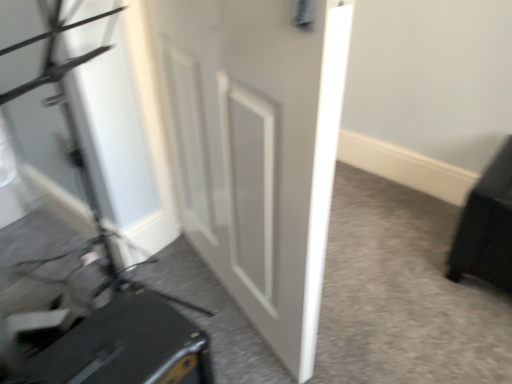
This screenshot has width=512, height=384. What do you see at coordinates (111, 269) in the screenshot?
I see `black matte suitcase at lower left` at bounding box center [111, 269].

At what (x,y) coordinates should I click in order to perform the action: click on matte black suitcase at lower left. Please return your answer as a coordinate pair (x, y). Looking at the image, I should click on (127, 347).

Is matte black suitcase at lower left placed right next to black matte suitcase at lower left?

matte black suitcase at lower left is not next to black matte suitcase at lower left, and they're not touching.

Where is `luggage that is behind the black matte suitcase at lower left`? This screenshot has height=384, width=512. luggage that is behind the black matte suitcase at lower left is located at coordinates (127, 347).

Is matte black suitcase at lower left inside or outside of black matte suitcase at lower left?

The correct answer is: outside.

Is matte black suitcase at lower left to the right of black matte suitcase at lower left from the viewer's perspective?

Correct, you'll find matte black suitcase at lower left to the right of black matte suitcase at lower left.

This screenshot has height=384, width=512. Find the location of `videotape positioned vertically above the white matte door at center (from a real-world perspective)`. videotape positioned vertically above the white matte door at center (from a real-world perspective) is located at coordinates (111, 269).

Measure the distance from white matte door at center to black matte suitcase at lower left.

A distance of 11.87 inches exists between white matte door at center and black matte suitcase at lower left.

Is white matte door at center positioned with its back to black matte suitcase at lower left?

Yes, black matte suitcase at lower left is at the back of white matte door at center.

In order to click on door located in front of the matte black suitcase at lower left in this screenshot , I will do `click(256, 149)`.

How different are the orientations of white matte door at center and matte black suitcase at lower left in degrees?

The facing directions of white matte door at center and matte black suitcase at lower left are 107 degrees apart.

Consider the image. From the image's perspective, would you say white matte door at center is positioned over matte black suitcase at lower left?

Yes.

How distant is white matte door at center from matte black suitcase at lower left?

white matte door at center is 15.51 inches away from matte black suitcase at lower left.

Does black matte suitcase at lower left come in front of white matte door at center?

Yes, black matte suitcase at lower left is in front of white matte door at center.

Can you confirm if black matte suitcase at lower left is bigger than white matte door at center?

Yes, black matte suitcase at lower left is bigger than white matte door at center.

Can you confirm if black matte suitcase at lower left is shorter than white matte door at center?

No, black matte suitcase at lower left is not shorter than white matte door at center.

Between point (77, 360) and point (306, 245), which one is positioned behind?

The point (306, 245) is farther.

From the image's perspective, is matte black suitcase at lower left under white matte door at center?

Yes, from the image's perspective, matte black suitcase at lower left is below white matte door at center.

Considering the relative sizes of matte black suitcase at lower left and white matte door at center in the image provided, is matte black suitcase at lower left taller than white matte door at center?

In fact, matte black suitcase at lower left may be shorter than white matte door at center.

Which of these two, matte black suitcase at lower left or white matte door at center, is wider?

With larger width is matte black suitcase at lower left.

Considering the positions of objects black matte suitcase at lower left and matte black suitcase at lower left in the image provided, who is more to the left, black matte suitcase at lower left or matte black suitcase at lower left?

black matte suitcase at lower left.

Identify the location of luggage on the right of the black matte suitcase at lower left. Image resolution: width=512 pixels, height=384 pixels. (127, 347).

From a real-world perspective, is black matte suitcase at lower left positioned above or below matte black suitcase at lower left?

From a real-world perspective, black matte suitcase at lower left is physically above matte black suitcase at lower left.

Is black matte suitcase at lower left in front of or behind matte black suitcase at lower left in the image?

In the image, black matte suitcase at lower left appears in front of matte black suitcase at lower left.

At what (x,y) coordinates should I click in order to perform the action: click on luggage behind the black matte suitcase at lower left. Please return your answer as a coordinate pair (x, y). Image resolution: width=512 pixels, height=384 pixels. Looking at the image, I should click on tap(127, 347).

Locate an element on the screen. This screenshot has width=512, height=384. videotape above the white matte door at center (from a real-world perspective) is located at coordinates (111, 269).

From the image, which object appears to be farther from black matte suitcase at lower left, matte black suitcase at lower left or white matte door at center?

white matte door at center.

Based on their spatial positions, is matte black suitcase at lower left or black matte suitcase at lower left closer to white matte door at center?

black matte suitcase at lower left lies closer to white matte door at center than the other object.

Based on their spatial positions, is black matte suitcase at lower left or matte black suitcase at lower left closer to white matte door at center?

black matte suitcase at lower left is closer to white matte door at center.

Which object lies nearer to the anchor point matte black suitcase at lower left, white matte door at center or black matte suitcase at lower left?

black matte suitcase at lower left is positioned closer to the anchor matte black suitcase at lower left.

Looking at the image, which one is located further to matte black suitcase at lower left, black matte suitcase at lower left or white matte door at center?

white matte door at center is further to matte black suitcase at lower left.

Estimate the real-world distances between objects in this image. Which object is closer to black matte suitcase at lower left, white matte door at center or matte black suitcase at lower left?

Based on the image, matte black suitcase at lower left appears to be nearer to black matte suitcase at lower left.

Find the location of a particular element. The height and width of the screenshot is (384, 512). videotape between white matte door at center and matte black suitcase at lower left in the up-down direction is located at coordinates (111, 269).